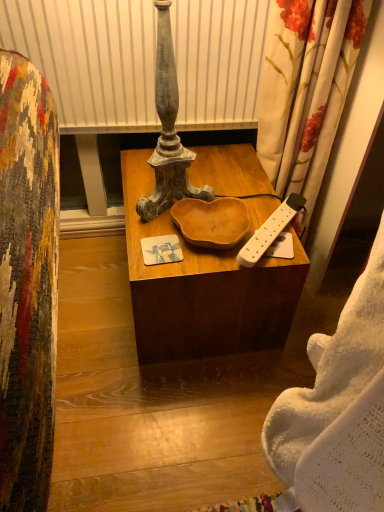
Find the location of a particular element. The image size is (384, 512). unoccupied space behind white plastic remote control at right is located at coordinates (251, 191).